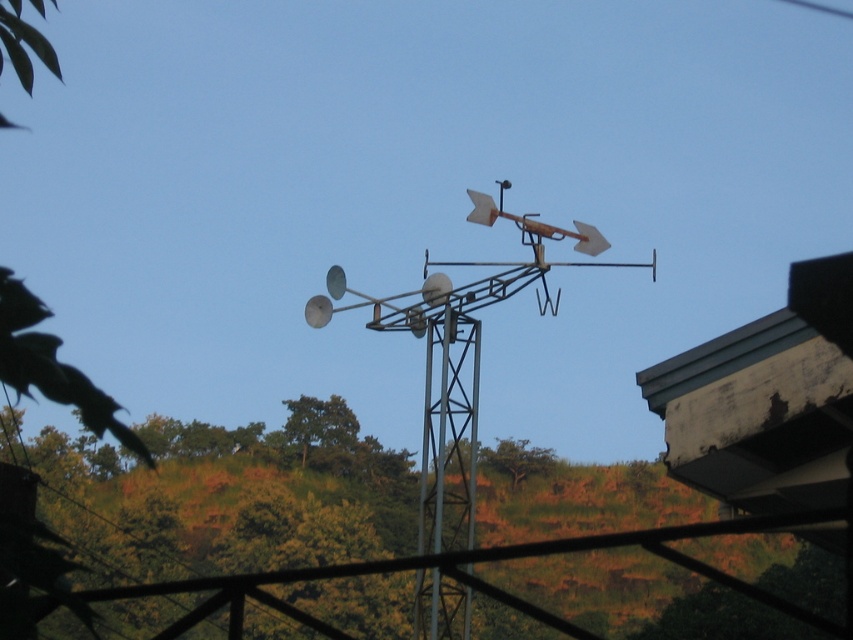
You are a drone operator trying to capture a closeup shot of the metallic silver vane at center. The drone can only fly up to 100 meters away from you. Can the drone reach the vane?

The metallic silver vane at center is 96.85 meters from camera. Since the drone can fly up to 100 meters, it can reach the vane as 96.85 meters is within the 100 meter limit.

You are standing in front of the weather station and notice two points marked on the pole. The first point is at coordinates point (471, 529) and the second is at point (444, 484). Which of these points is nearer to your eyes?

Point (471, 529) is closer to the camera than point (444, 484), so the first point is nearer to your eyes.

You are a maintenance worker needing to inspect both the metallic silver vane at center and the metallic gray pole at center. Given that you have a ladder that is 1.5 meters long, can you safely reach both objects from the ground without moving the ladder?

The distance between the metallic silver vane at center and the metallic gray pole at center is 1.34 meters. Since the ladder is 1.5 meters long, which is longer than the distance between them, you can safely reach both objects from the ground without moving the ladder.